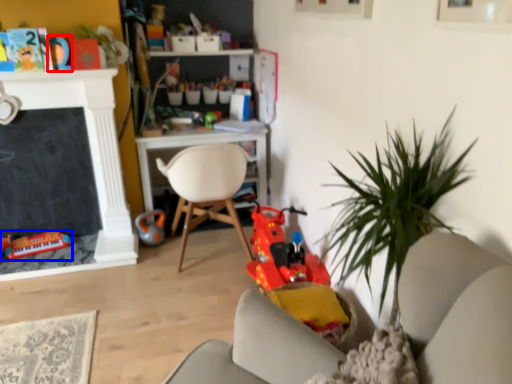
Question: Among these objects, which one is farthest to the camera, toy (highlighted by a red box) or toy (highlighted by a blue box)?

Choices:
 (A) toy
 (B) toy

Answer: (B)